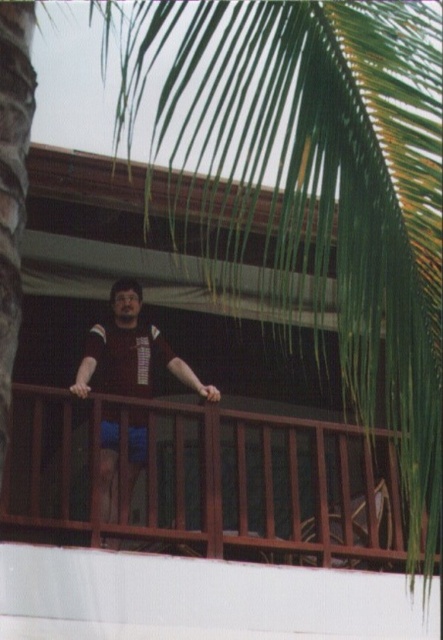
Does point (365, 488) come closer to viewer compared to point (139, 291)?

Yes.

Between brown wooden railing at center and matte black shirt at center, which one is positioned lower?

brown wooden railing at center is lower down.

Does point (388, 557) come closer to viewer compared to point (86, 349)?

Yes, it is.

I want to click on brown wooden railing at center, so click(208, 477).